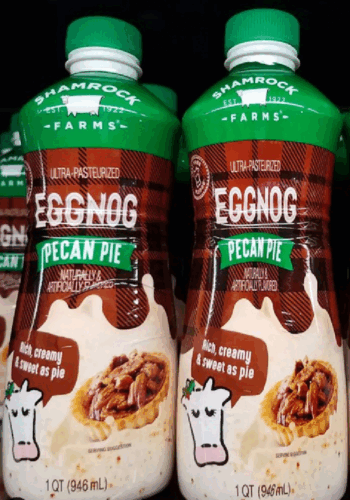
This screenshot has width=350, height=500. Find the location of `bottles`. bottles is located at coordinates (116, 325), (264, 295), (14, 211).